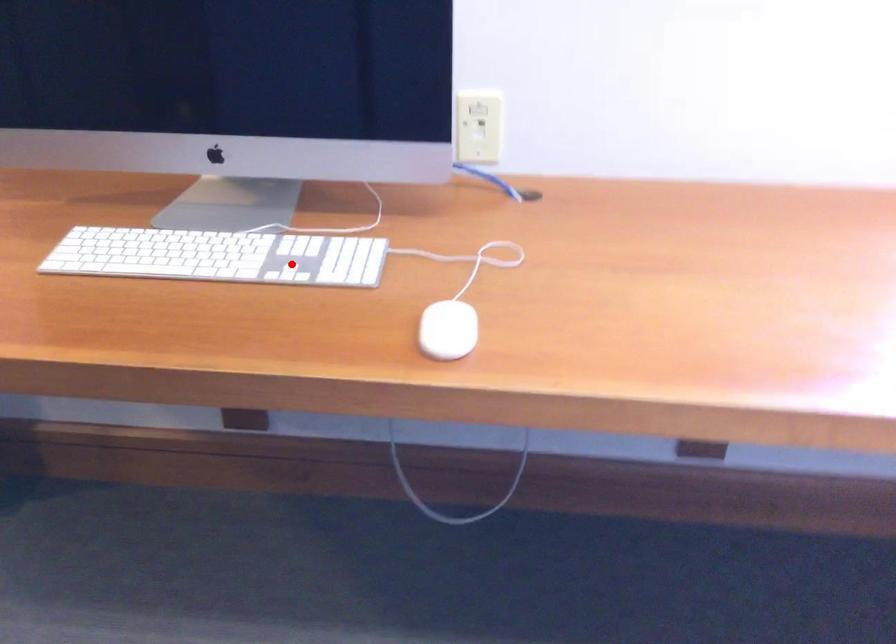
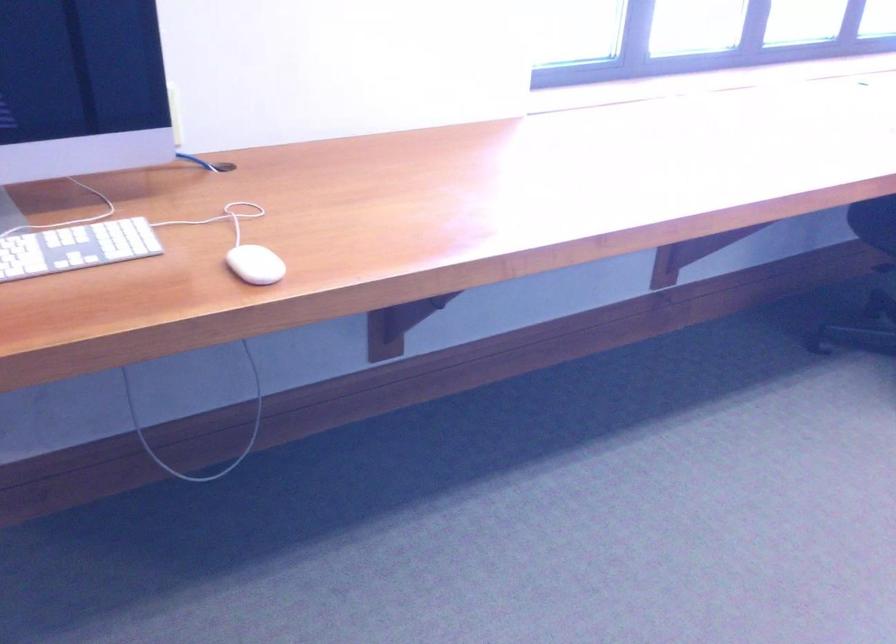
In the second image, find the point that corresponds to the highlighted location in the first image.

(75, 247)